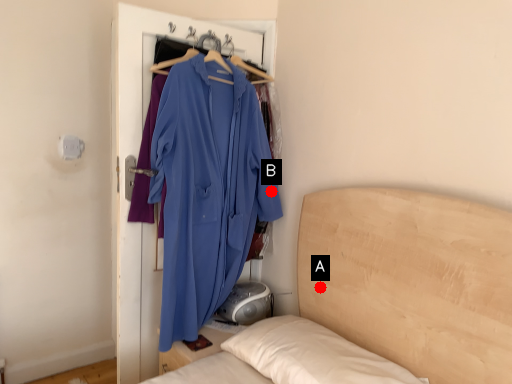
Question: Two points are circled on the image, labeled by A and B beside each circle. Which point is closer to the camera?

Choices:
 (A) A is closer
 (B) B is closer

Answer: (A)